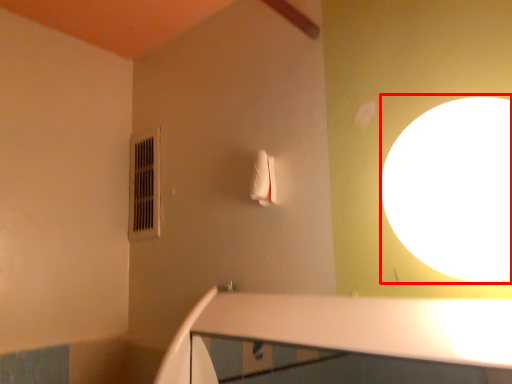
Question: Where is light (annotated by the red box) located in relation to air conditioner in the image?

Choices:
 (A) left
 (B) right

Answer: (B)